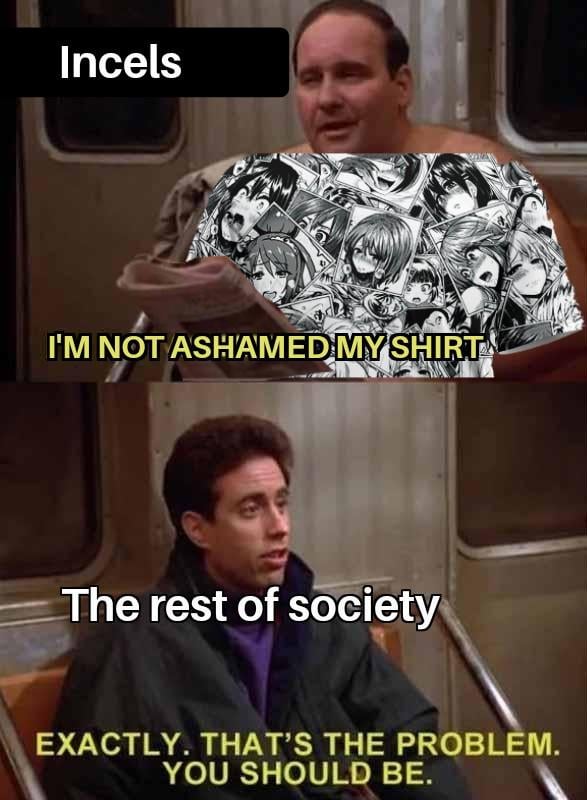
The height and width of the screenshot is (800, 587). What are the coordinates of `seat cushion` in the screenshot? It's located at (23, 712), (582, 238).